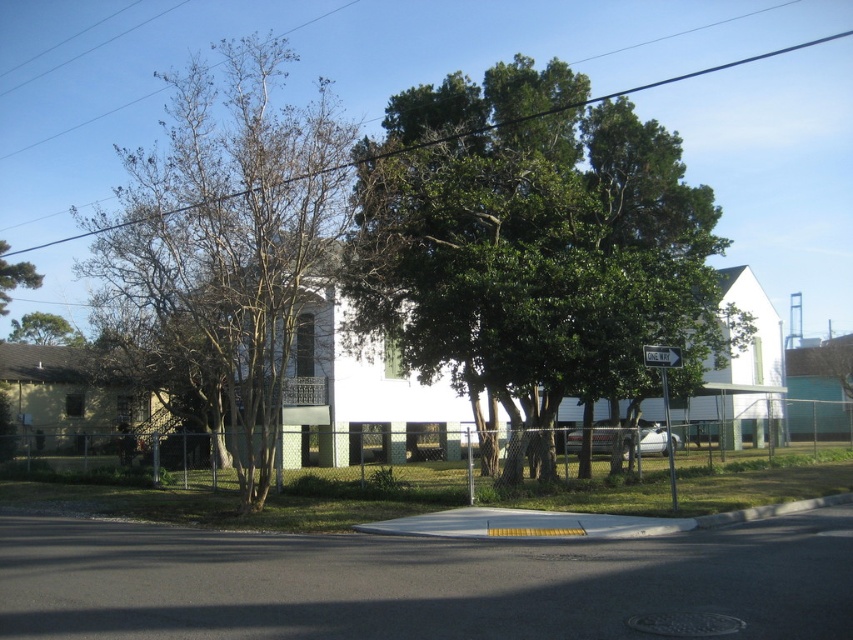
You are a city planner checking the distance between the bare wood tree at left and the black wire at upper center. According to safety regulations, trees must be at least 10 meters away from overhead wires. Is this distance compliant?

The bare wood tree at left is 8.46 meters from the black wire at upper center, which is less than the required 10 meters. This does not comply with safety regulations.

You are standing at the point marked as point [532,241] in the image. Looking around, you see a green leafy tree at center. Which direction should you walk to reach the chain link fence that separates the residential area from the houses and trees beyond?

Since the point [532,241] is where the green leafy tree at center is located, you should walk towards the direction opposite of the chain link fence. However, according to the scene description, the chain link fence runs along the edge of the property, so to reach it, you would need to walk away from the green leafy tree at center towards the boundary marked by the fence.